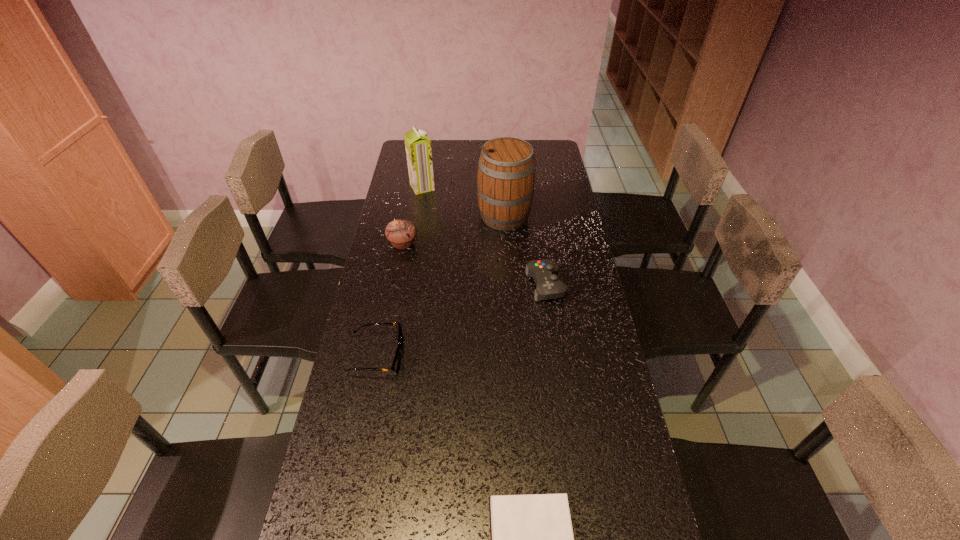
The height and width of the screenshot is (540, 960). Find the location of `free space between the sunglasses and the farthest object`. free space between the sunglasses and the farthest object is located at coordinates (399, 272).

Identify the location of vacant space in between the second farthest object and the fourth shortest object. The width and height of the screenshot is (960, 540). (454, 230).

This screenshot has height=540, width=960. What are the coordinates of `vacant area between the farthest object and the fourth shortest object` in the screenshot? It's located at (413, 215).

The image size is (960, 540). Identify the location of vacant area that lies between the soya milk and the muffin. (413, 215).

At what (x,y) coordinates should I click in order to perform the action: click on free space between the fourth farthest object and the sunglasses. Please return your answer as a coordinate pair (x, y). This screenshot has height=540, width=960. Looking at the image, I should click on (462, 321).

Where is `free space between the fourth farthest object and the fifth farthest object`? This screenshot has width=960, height=540. free space between the fourth farthest object and the fifth farthest object is located at coordinates (462, 321).

The image size is (960, 540). In order to click on object identified as the closest to the control in this screenshot , I will do `click(506, 169)`.

Locate an element on the screen. The image size is (960, 540). object that stands as the third closest to the third nearest object is located at coordinates (395, 367).

Locate an element on the screen. The image size is (960, 540). vacant space that satisfies the following two spatial constraints: 1. on the back side of the cider; 2. on the left side of the fourth shortest object is located at coordinates (x=408, y=216).

At what (x,y) coordinates should I click in order to perform the action: click on free space in the image that satisfies the following two spatial constraints: 1. on the front side of the control; 2. on the right side of the third tallest object. Please return your answer as a coordinate pair (x, y). Looking at the image, I should click on (395, 285).